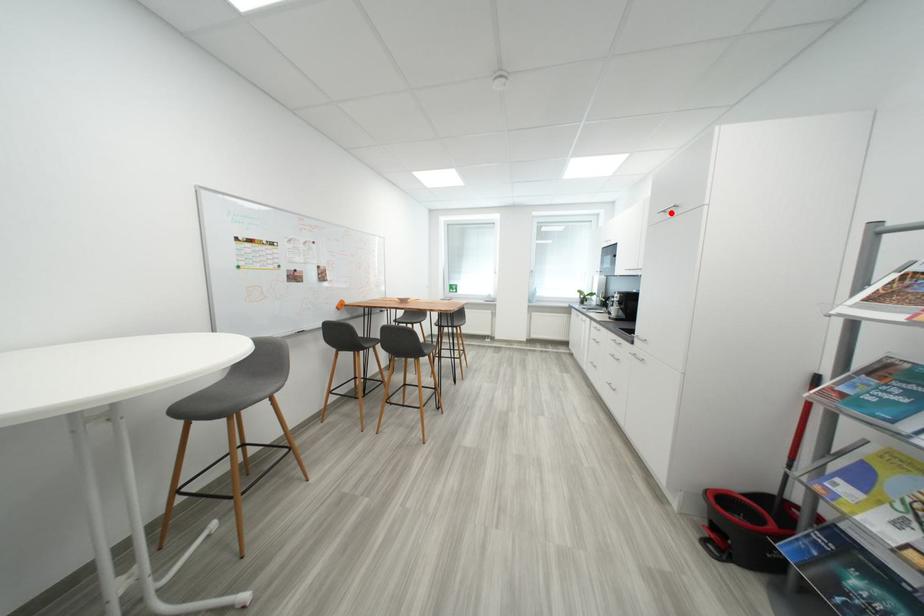
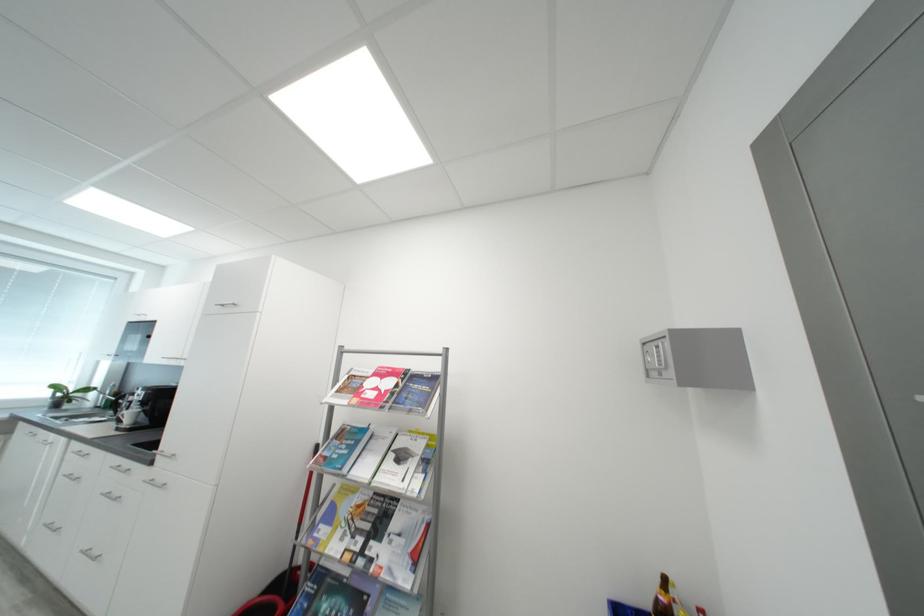
In the second image, find the point that corresponds to the highlighted location in the first image.

(228, 307)